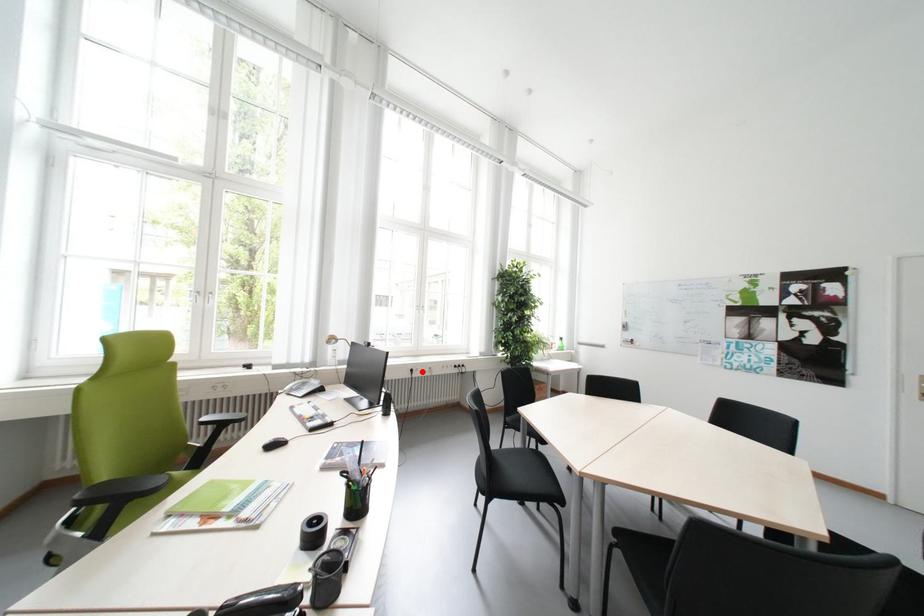
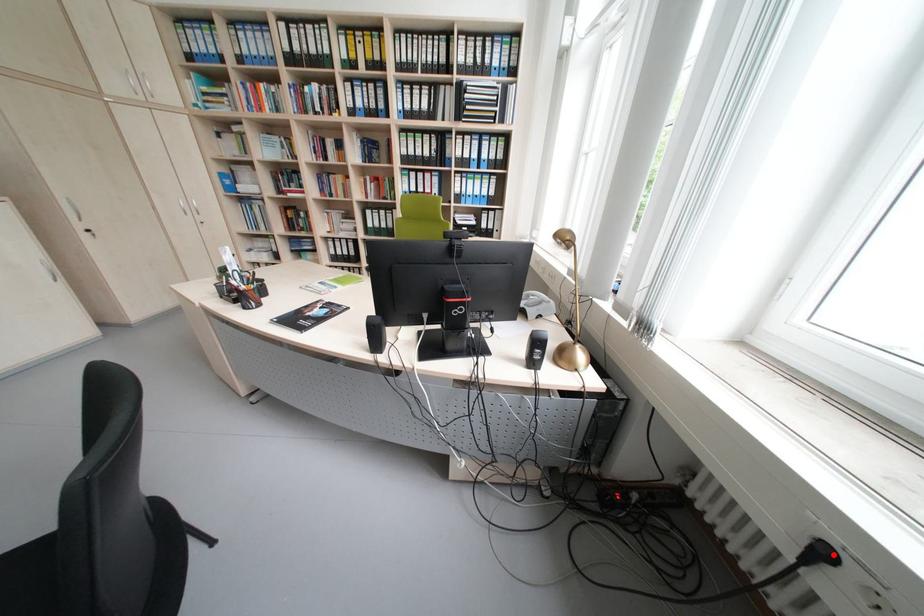
I am providing you with two images of the same scene from different viewpoints. A red point is marked on the first image and another point is marked on the second image. Does the point marked in image1 correspond to the same location as the one in image2?

Yes